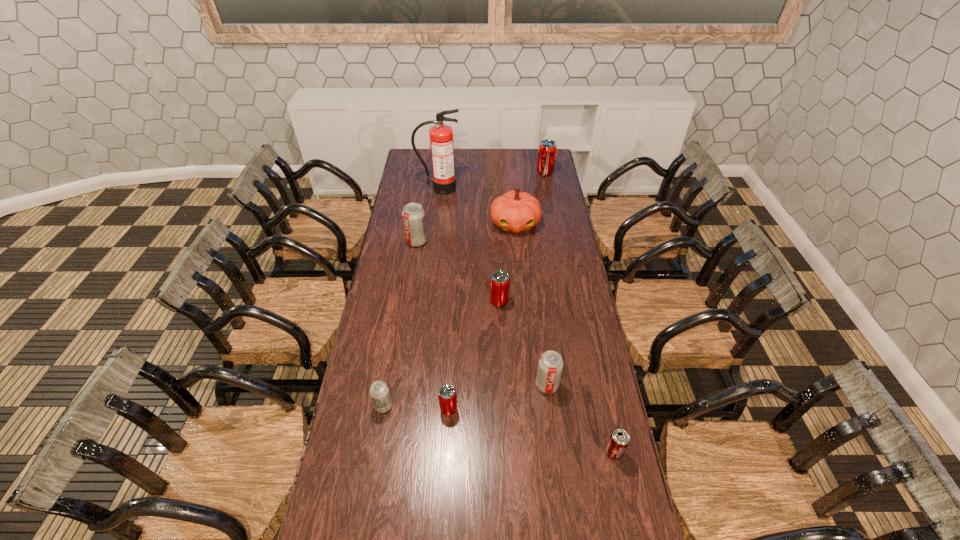
Locate an element on the screen. vacant space at the far edge of the desktop is located at coordinates (515, 167).

This screenshot has height=540, width=960. In order to click on vacant region at the left edge of the desktop in this screenshot , I will do `click(356, 423)`.

What are the coordinates of `free point between the second smallest gray soda can and the beer can` in the screenshot? It's located at (581, 418).

Locate an element on the screen. The height and width of the screenshot is (540, 960). vacant region between the farthest gray soda can and the smallest gray soda can is located at coordinates (400, 323).

I want to click on free area in between the second smallest red soda can and the leftmost red soda can, so click(x=474, y=355).

Find the location of a particular element. free space between the second farthest gray soda can and the pumpkin is located at coordinates (531, 304).

The width and height of the screenshot is (960, 540). Identify the location of vacant space that's between the farthest object and the beer can. (579, 313).

You are a GUI agent. You are given a task and a screenshot of the screen. Output one action in this format:
    pyautogui.click(x=<x>, y=<y>)
    Task: Click on the vacant space in between the biggest red soda can and the fire extinguisher
    Image resolution: width=960 pixels, height=540 pixels.
    Given the screenshot: What is the action you would take?
    pyautogui.click(x=492, y=180)

Where is `vacant region between the nearest object and the leftmost red soda can`? vacant region between the nearest object and the leftmost red soda can is located at coordinates (531, 431).

Identify which object is located as the fifth nearest to the second smallest red soda can. Please provide its 2D coordinates. Your answer should be formatted as a tuple, i.e. [(x, y)], where the tuple contains the x and y coordinates of a point satisfying the conditions above.

[(379, 391)]